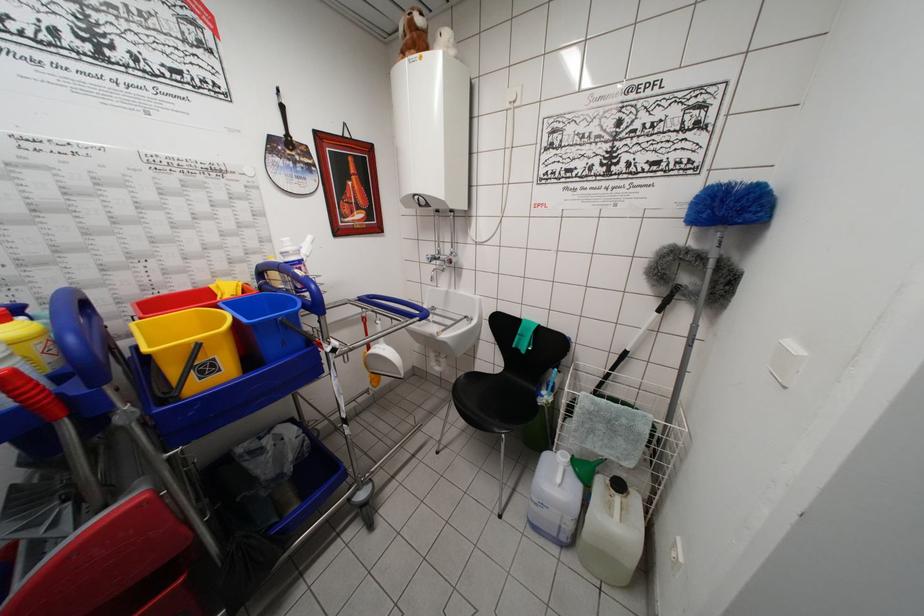
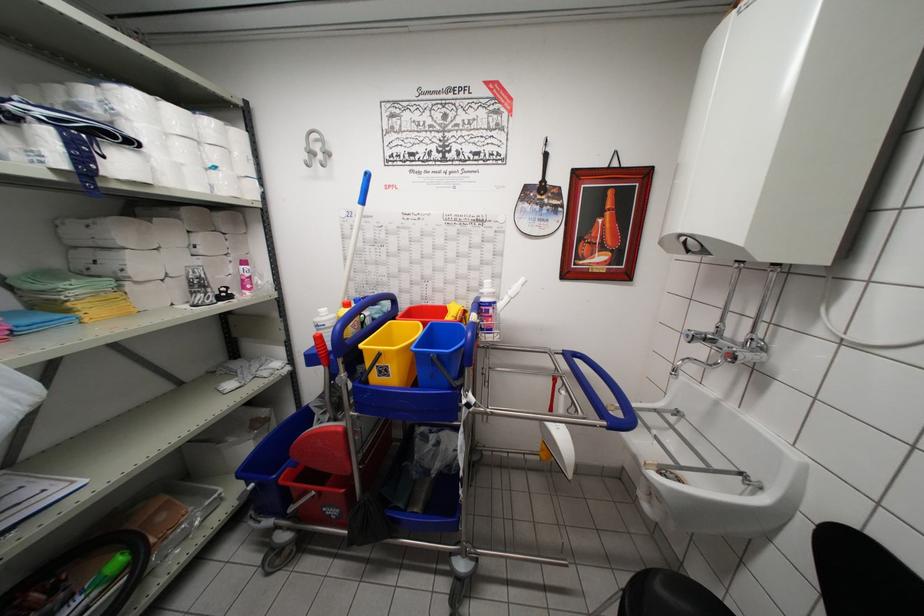
Question: Based on the continuous images, in which direction is the camera rotating? Reply with the corresponding letter.

Choices:
 (A) Left
 (B) Right
 (C) Up
 (D) Down

Answer: (A)